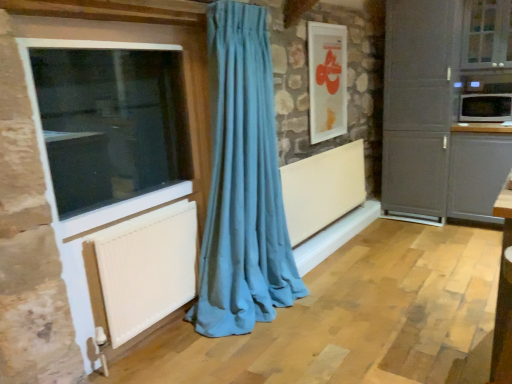
Question: Does matte gray cabinet at right, arranged as the 2th cabinetry when viewed from the right, have a lesser height compared to clear glass window at upper right, acting as the 1th window starting from the top?

Choices:
 (A) yes
 (B) no

Answer: (B)

Question: Is matte gray cabinet at right, acting as the 1th cabinetry starting from the left, to the left of clear glass window at upper right, which is the first window in right-to-left order, from the viewer's perspective?

Choices:
 (A) no
 (B) yes

Answer: (B)

Question: From a real-world perspective, is matte gray cabinet at right, arranged as the 2th cabinetry when viewed from the right, on top of clear glass window at upper right, the second window when ordered from bottom to top?

Choices:
 (A) yes
 (B) no

Answer: (B)

Question: Is matte gray cabinet at right, arranged as the 2th cabinetry when viewed from the right, positioned behind clear glass window at upper right, which appears as the second window when viewed from the left?

Choices:
 (A) yes
 (B) no

Answer: (A)

Question: Considering the relative positions of matte gray cabinet at right, arranged as the 2th cabinetry when viewed from the right, and clear glass window at upper right, the second window when ordered from bottom to top, in the image provided, is matte gray cabinet at right, arranged as the 2th cabinetry when viewed from the right, in front of clear glass window at upper right, the second window when ordered from bottom to top,?

Choices:
 (A) no
 (B) yes

Answer: (A)

Question: Is matte gray cabinet at right, acting as the 1th cabinetry starting from the left, completely or partially outside of clear glass window at upper right, which appears as the 1th window when viewed from the back?

Choices:
 (A) yes
 (B) no

Answer: (A)

Question: Is white plastic window at left, the 1th window from the front, to the left of matte gray cabinet at right, which is the 2th cabinetry from left to right, from the viewer's perspective?

Choices:
 (A) no
 (B) yes

Answer: (B)

Question: Is white plastic window at left, marked as the 2th window in a top-to-bottom arrangement, aimed at matte gray cabinet at right, which appears as the 1th cabinetry when viewed from the right?

Choices:
 (A) no
 (B) yes

Answer: (A)

Question: Is there a large distance between white plastic window at left, which appears as the 2th window when viewed from the right, and matte gray cabinet at right, which appears as the 1th cabinetry when viewed from the right?

Choices:
 (A) no
 (B) yes

Answer: (B)

Question: Is white plastic window at left, which is the 1th window in bottom-to-top order, with matte gray cabinet at right, which appears as the 1th cabinetry when viewed from the right?

Choices:
 (A) no
 (B) yes

Answer: (A)

Question: From a real-world perspective, does white plastic window at left, marked as the 2th window in a top-to-bottom arrangement, stand above matte gray cabinet at right, which appears as the 1th cabinetry when viewed from the right?

Choices:
 (A) no
 (B) yes

Answer: (B)

Question: Can you confirm if white plastic window at left, which appears as the 2th window when viewed from the right, is shorter than matte gray cabinet at right, which is the 2th cabinetry from left to right?

Choices:
 (A) no
 (B) yes

Answer: (B)

Question: Is white textured radiator at lower left, which is the first radiator from front to back, outside white glossy picture frame at upper center?

Choices:
 (A) no
 (B) yes

Answer: (B)